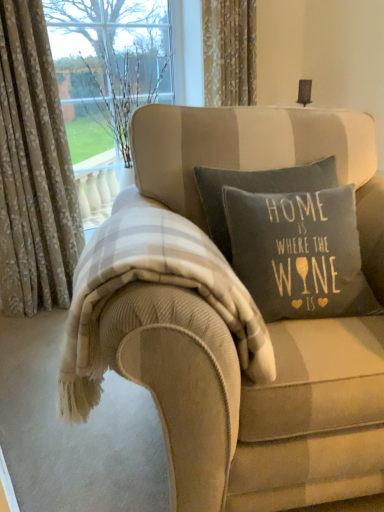
Consider the image. What is the approximate height of dark gray cotton pillow at center?

It is 21.71 inches.

I want to click on floral-patterned fabric at left, arranged as the first curtain when viewed from the left, so click(34, 170).

In order to click on gold textured curtain at upper center, which is the 2th curtain from left to right in this screenshot , I will do `click(229, 52)`.

Is gold textured curtain at upper center, which is the 2th curtain from left to right, far from beige corduroy couch at center?

Absolutely, gold textured curtain at upper center, which is the 2th curtain from left to right, is distant from beige corduroy couch at center.

Is gold textured curtain at upper center, which is the 2th curtain from left to right, wider or thinner than beige corduroy couch at center?

Considering their sizes, gold textured curtain at upper center, which is the 2th curtain from left to right, looks slimmer than beige corduroy couch at center.

From the image's perspective, which is above, gold textured curtain at upper center, which is the 2th curtain from left to right, or beige corduroy couch at center?

gold textured curtain at upper center, which is the 2th curtain from left to right, appears higher in the image.

Considering the relative sizes of gold textured curtain at upper center, the first curtain in the right-to-left sequence, and floral-patterned fabric at left, the second curtain from the right, in the image provided, is gold textured curtain at upper center, the first curtain in the right-to-left sequence, taller than floral-patterned fabric at left, the second curtain from the right,?

No.

Image resolution: width=384 pixels, height=512 pixels. I want to click on curtain to the left of gold textured curtain at upper center, which is the 2th curtain from left to right, so pos(34,170).

Between gold textured curtain at upper center, the first curtain in the right-to-left sequence, and floral-patterned fabric at left, the second curtain from the right, which one has smaller width?

gold textured curtain at upper center, the first curtain in the right-to-left sequence, is thinner.

Between point (241, 63) and point (1, 59), which one is positioned behind?

Positioned behind is point (241, 63).

In the scene shown: Between floral-patterned fabric at left, arranged as the first curtain when viewed from the left, and gold textured curtain at upper center, the first curtain in the right-to-left sequence, which one has larger size?

With larger size is floral-patterned fabric at left, arranged as the first curtain when viewed from the left.

From the image's perspective, is floral-patterned fabric at left, arranged as the first curtain when viewed from the left, positioned above or below gold textured curtain at upper center, which is the 2th curtain from left to right?

floral-patterned fabric at left, arranged as the first curtain when viewed from the left, is below gold textured curtain at upper center, which is the 2th curtain from left to right.

Where is `curtain below the gold textured curtain at upper center, which is the 2th curtain from left to right (from a real-world perspective)`? curtain below the gold textured curtain at upper center, which is the 2th curtain from left to right (from a real-world perspective) is located at coordinates (34, 170).

Is dark gray cotton pillow at center to the left or to the right of beige corduroy couch at center in the image?

Clearly, dark gray cotton pillow at center is on the right of beige corduroy couch at center in the image.

From the image's perspective, is dark gray cotton pillow at center located beneath beige corduroy couch at center?

No, from the image's perspective, dark gray cotton pillow at center is not beneath beige corduroy couch at center.

Is dark gray cotton pillow at center situated inside beige corduroy couch at center or outside?

dark gray cotton pillow at center lies within the bounds of beige corduroy couch at center.

Is dark gray cotton pillow at center not near beige corduroy couch at center?

Actually, dark gray cotton pillow at center and beige corduroy couch at center are a little close together.

How distant is plaid wool blanket at center from gold textured curtain at upper center, the first curtain in the right-to-left sequence?

plaid wool blanket at center and gold textured curtain at upper center, the first curtain in the right-to-left sequence, are 1.39 meters apart from each other.

Are plaid wool blanket at center and gold textured curtain at upper center, which is the 2th curtain from left to right, beside each other?

No, plaid wool blanket at center is not beside gold textured curtain at upper center, which is the 2th curtain from left to right.

What are the coordinates of `curtain on the right of plaid wool blanket at center` in the screenshot? It's located at [229, 52].

Is plaid wool blanket at center inside or outside of gold textured curtain at upper center, which is the 2th curtain from left to right?

plaid wool blanket at center is spatially situated outside gold textured curtain at upper center, which is the 2th curtain from left to right.

Which is more to the left, beige corduroy couch at center or dark gray cotton pillow at center?

beige corduroy couch at center.

Consider the image. Which of these two, beige corduroy couch at center or dark gray cotton pillow at center, is thinner?

dark gray cotton pillow at center is thinner.

From a real-world perspective, who is located higher, floral-patterned fabric at left, arranged as the first curtain when viewed from the left, or plaid wool blanket at center?

floral-patterned fabric at left, arranged as the first curtain when viewed from the left.

Between point (20, 201) and point (240, 358), which one is positioned in front?

The point (240, 358) is closer to the camera.

Who is more distant, floral-patterned fabric at left, arranged as the first curtain when viewed from the left, or plaid wool blanket at center?

floral-patterned fabric at left, arranged as the first curtain when viewed from the left.

Considering the sizes of objects floral-patterned fabric at left, the second curtain from the right, and plaid wool blanket at center in the image provided, who is thinner, floral-patterned fabric at left, the second curtain from the right, or plaid wool blanket at center?

With smaller width is floral-patterned fabric at left, the second curtain from the right.

This screenshot has width=384, height=512. I want to click on studio couch below the gold textured curtain at upper center, the first curtain in the right-to-left sequence (from a real-world perspective), so click(x=238, y=394).

You are a GUI agent. You are given a task and a screenshot of the screen. Output one action in this format:
    pyautogui.click(x=<x>, y=<y>)
    Task: Click on the curtain located above the floral-patterned fabric at left, the second curtain from the right (from the image's perspective)
    The height and width of the screenshot is (512, 384).
    Given the screenshot: What is the action you would take?
    pyautogui.click(x=229, y=52)

Based on their spatial positions, is plaid wool blanket at center or beige corduroy couch at center further from dark gray cotton pillow at center?

Based on the image, plaid wool blanket at center appears to be further to dark gray cotton pillow at center.

Looking at the image, which one is located closer to beige corduroy couch at center, gold textured curtain at upper center, which is the 2th curtain from left to right, or floral-patterned fabric at left, the second curtain from the right?

Among the two, floral-patterned fabric at left, the second curtain from the right, is located nearer to beige corduroy couch at center.

From the image, which object appears to be farther from beige corduroy couch at center, floral-patterned fabric at left, arranged as the first curtain when viewed from the left, or dark gray cotton pillow at center?

The object further to beige corduroy couch at center is floral-patterned fabric at left, arranged as the first curtain when viewed from the left.

Which object lies nearer to the anchor point beige corduroy couch at center, floral-patterned fabric at left, the second curtain from the right, or gold textured curtain at upper center, which is the 2th curtain from left to right?

Based on the image, floral-patterned fabric at left, the second curtain from the right, appears to be nearer to beige corduroy couch at center.

Considering their positions, is gold textured curtain at upper center, which is the 2th curtain from left to right, positioned closer to floral-patterned fabric at left, arranged as the first curtain when viewed from the left, than dark gray cotton pillow at center?

Among the two, gold textured curtain at upper center, which is the 2th curtain from left to right, is located nearer to floral-patterned fabric at left, arranged as the first curtain when viewed from the left.

From the image, which object appears to be nearer to gold textured curtain at upper center, the first curtain in the right-to-left sequence, beige corduroy couch at center or plaid wool blanket at center?

Based on the image, plaid wool blanket at center appears to be nearer to gold textured curtain at upper center, the first curtain in the right-to-left sequence.

From the picture: When comparing their distances from floral-patterned fabric at left, arranged as the first curtain when viewed from the left, does dark gray cotton pillow at center or plaid wool blanket at center seem closer?

plaid wool blanket at center.

Looking at the image, which one is located further to floral-patterned fabric at left, arranged as the first curtain when viewed from the left, gold textured curtain at upper center, the first curtain in the right-to-left sequence, or plaid wool blanket at center?

plaid wool blanket at center lies further to floral-patterned fabric at left, arranged as the first curtain when viewed from the left, than the other object.

Locate an element on the screen. This screenshot has height=512, width=384. pillow located between plaid wool blanket at center and gold textured curtain at upper center, which is the 2th curtain from left to right, in the depth direction is located at coordinates (299, 253).

Find the location of a particular element. curtain situated between floral-patterned fabric at left, the second curtain from the right, and dark gray cotton pillow at center from left to right is located at coordinates (229, 52).

The height and width of the screenshot is (512, 384). In order to click on pillow between beige corduroy couch at center and gold textured curtain at upper center, which is the 2th curtain from left to right, from front to back in this screenshot , I will do `click(299, 253)`.

You are a GUI agent. You are given a task and a screenshot of the screen. Output one action in this format:
    pyautogui.click(x=<x>, y=<y>)
    Task: Click on the curtain between beige corduroy couch at center and gold textured curtain at upper center, the first curtain in the right-to-left sequence, from front to back
    The height and width of the screenshot is (512, 384).
    Given the screenshot: What is the action you would take?
    pyautogui.click(x=34, y=170)